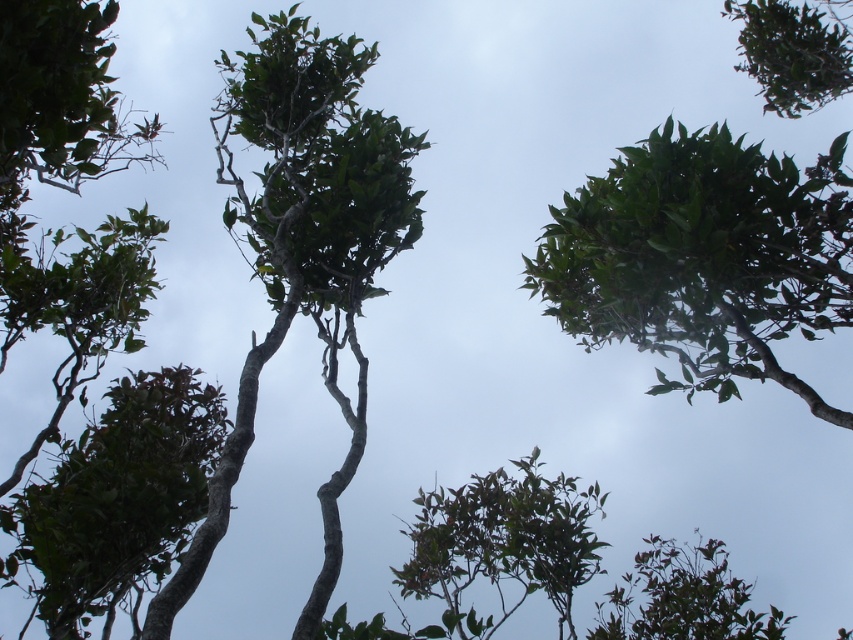
Can you confirm if green matte tree at center is positioned below green matte tree at lower left?

No, green matte tree at center is not below green matte tree at lower left.

Identify the location of green matte tree at center. (303, 246).

I want to click on green matte tree at center, so click(x=303, y=246).

Is green matte tree at upper center positioned in front of green matte tree at lower left?

Yes, green matte tree at upper center is in front of green matte tree at lower left.

In the scene shown: Measure the distance between green matte tree at upper center and camera.

green matte tree at upper center and camera are 5.60 meters apart.

The width and height of the screenshot is (853, 640). In order to click on green matte tree at upper center in this screenshot , I will do `click(703, 257)`.

Is green matte tree at upper center wider than green matte tree at center?

Yes.

Can you confirm if green matte tree at upper center is thinner than green matte tree at center?

In fact, green matte tree at upper center might be wider than green matte tree at center.

Does point (706, 324) come closer to viewer compared to point (294, 32)?

Yes.

The height and width of the screenshot is (640, 853). In order to click on green matte tree at upper center in this screenshot , I will do `click(703, 257)`.